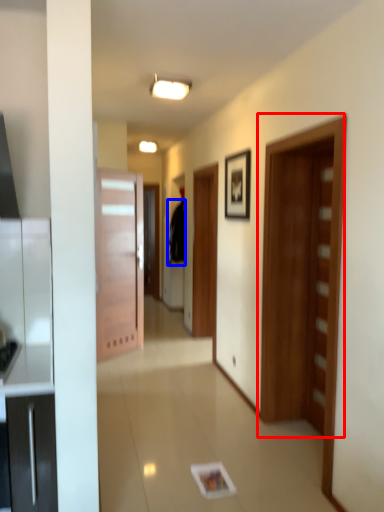
Question: Which object is closer to the camera taking this photo, door (highlighted by a red box) or robe (highlighted by a blue box)?

Choices:
 (A) door
 (B) robe

Answer: (A)